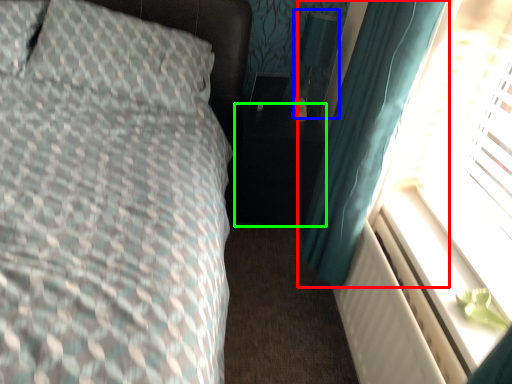
Question: Based on their relative distances, which object is farther from curtain (highlighted by a red box)? Choose from table lamp (highlighted by a blue box) and side table (highlighted by a green box).

Choices:
 (A) table lamp
 (B) side table

Answer: (A)